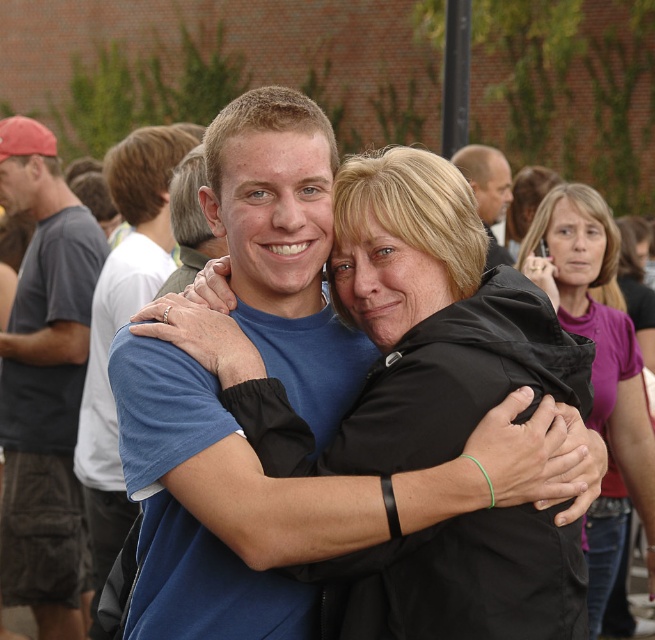
Question: Does purple matte shirt at upper right lie behind blue t-shirt at left?

Choices:
 (A) no
 (B) yes

Answer: (A)

Question: Which object appears closest to the camera in this image?

Choices:
 (A) purple matte shirt at upper right
 (B) dark gray t-shirt at left
 (C) blue t-shirt at left

Answer: (A)

Question: Which object is closer to the camera taking this photo?

Choices:
 (A) purple matte shirt at upper right
 (B) blue t-shirt at left

Answer: (A)

Question: Is dark gray t-shirt at left bigger than smooth gray hair at upper center?

Choices:
 (A) yes
 (B) no

Answer: (A)

Question: Is dark gray t-shirt at left above smooth gray hair at upper center?

Choices:
 (A) no
 (B) yes

Answer: (A)

Question: Estimate the real-world distances between objects in this image. Which object is farther from the blue t-shirt at left?

Choices:
 (A) dark gray t-shirt at left
 (B) smooth gray hair at upper center

Answer: (B)